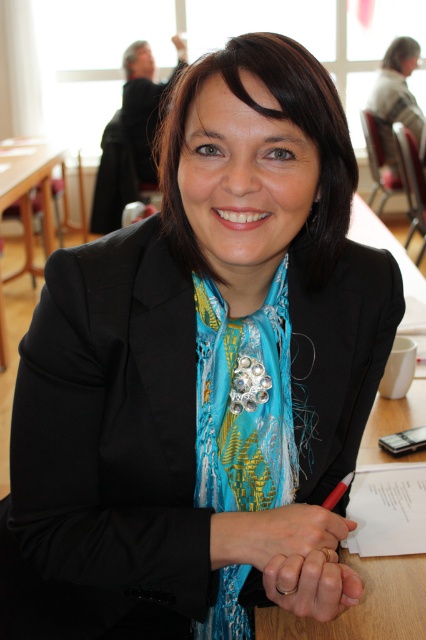
This screenshot has height=640, width=426. Find the location of `shiny blue scarf at center`. shiny blue scarf at center is located at coordinates pos(244,401).

Does shiny blue scarf at center have a smaller size compared to wooden table at left?

Indeed, shiny blue scarf at center has a smaller size compared to wooden table at left.

Identify the location of shiny blue scarf at center. (244, 401).

The height and width of the screenshot is (640, 426). Identify the location of shiny blue scarf at center. (244, 401).

Where is `shiny blue scarf at center`? The height and width of the screenshot is (640, 426). shiny blue scarf at center is located at coordinates (244, 401).

Who is lower down, shiny blue scarf at center or metallic red pen at center?

metallic red pen at center

Find the location of a particular element. The height and width of the screenshot is (640, 426). shiny blue scarf at center is located at coordinates (244, 401).

Can you confirm if wooden table at left is positioned to the left of metallic red pen at center?

Indeed, wooden table at left is positioned on the left side of metallic red pen at center.

Is wooden table at left taller than metallic red pen at center?

Yes, wooden table at left is taller than metallic red pen at center.

Locate an element on the screen. The image size is (426, 640). wooden table at left is located at coordinates (28, 189).

I want to click on wooden table at left, so click(28, 189).